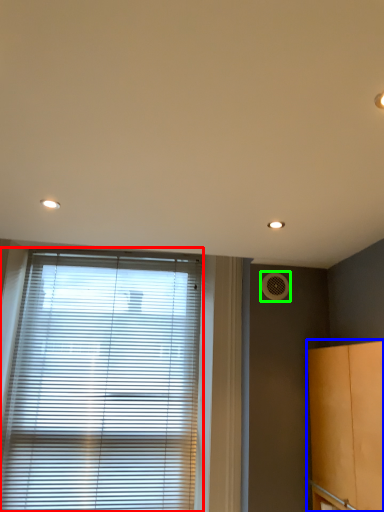
Question: Which object is positioned farthest from window blind (highlighted by a red box)? Select from cabinetry (highlighted by a blue box) and air conditioning (highlighted by a green box).

Choices:
 (A) cabinetry
 (B) air conditioning

Answer: (A)